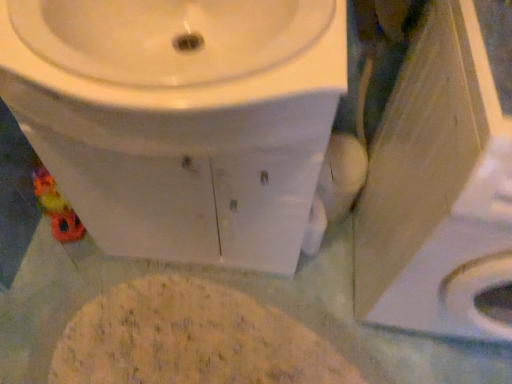
Question: Considering the relative sizes of white glossy sink at upper center and white glossy toilet at center in the image provided, is white glossy sink at upper center bigger than white glossy toilet at center?

Choices:
 (A) yes
 (B) no

Answer: (B)

Question: From the image's perspective, is white glossy sink at upper center below white glossy toilet at center?

Choices:
 (A) yes
 (B) no

Answer: (B)

Question: Is white glossy sink at upper center thinner than white glossy toilet at center?

Choices:
 (A) no
 (B) yes

Answer: (A)

Question: Considering the relative sizes of white glossy sink at upper center and white glossy toilet at center in the image provided, is white glossy sink at upper center wider than white glossy toilet at center?

Choices:
 (A) yes
 (B) no

Answer: (A)

Question: Does white glossy sink at upper center have a smaller size compared to white glossy toilet at center?

Choices:
 (A) yes
 (B) no

Answer: (A)

Question: Is white glossy toilet at center inside white glossy sink at upper center?

Choices:
 (A) no
 (B) yes

Answer: (A)

Question: Is white glossy sink at upper center not within yellowish powder at center?

Choices:
 (A) yes
 (B) no

Answer: (A)

Question: Are white glossy sink at upper center and yellowish powder at center far apart?

Choices:
 (A) no
 (B) yes

Answer: (A)

Question: Does white glossy sink at upper center have a greater width compared to yellowish powder at center?

Choices:
 (A) yes
 (B) no

Answer: (A)

Question: Could you tell me if white glossy sink at upper center is turned towards yellowish powder at center?

Choices:
 (A) yes
 (B) no

Answer: (B)

Question: Is white glossy sink at upper center behind yellowish powder at center?

Choices:
 (A) yes
 (B) no

Answer: (B)

Question: Considering the relative sizes of white glossy sink at upper center and yellowish powder at center in the image provided, is white glossy sink at upper center thinner than yellowish powder at center?

Choices:
 (A) no
 (B) yes

Answer: (A)

Question: Does white glossy toilet at center have a greater height compared to white glossy sink at upper center?

Choices:
 (A) no
 (B) yes

Answer: (B)